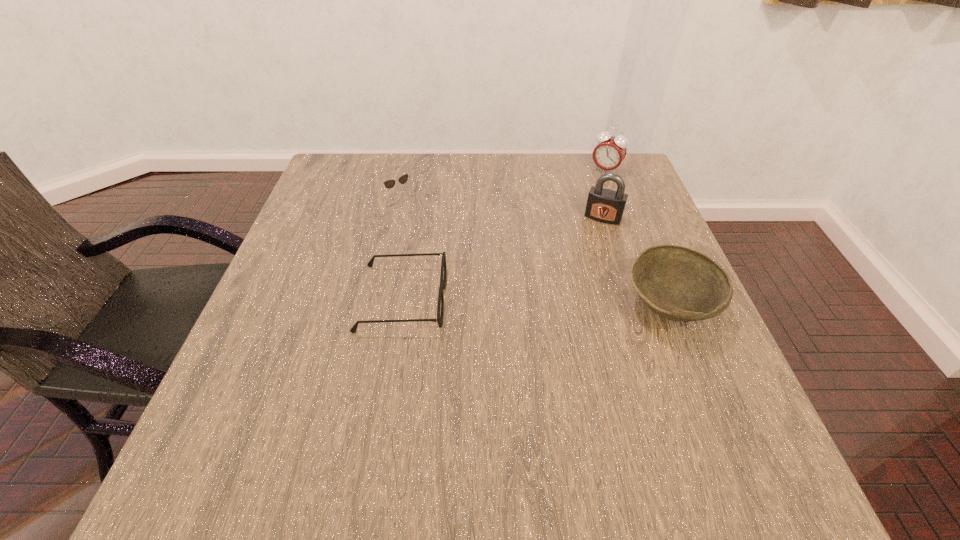
Identify the location of unoccupied area between the shortest object and the farthest object. The image size is (960, 540). (504, 234).

Find the location of a particular element. The width and height of the screenshot is (960, 540). vacant region between the alarm clock and the sunglasses is located at coordinates (503, 184).

Find the location of a particular element. The image size is (960, 540). free space between the bowl and the sunglasses is located at coordinates (535, 252).

Where is `free space between the padlock and the sunglasses`? The width and height of the screenshot is (960, 540). free space between the padlock and the sunglasses is located at coordinates (502, 208).

Find the location of `vacant space in between the padlock and the sunglasses`. vacant space in between the padlock and the sunglasses is located at coordinates (502, 208).

Locate an element on the screen. Image resolution: width=960 pixels, height=540 pixels. unoccupied position between the spectacles and the alarm clock is located at coordinates (504, 234).

I want to click on vacant area between the sunglasses and the bowl, so click(x=535, y=252).

Locate an element on the screen. This screenshot has width=960, height=540. empty location between the bowl and the shortest object is located at coordinates (535, 302).

Identify which object is the nearest to the bowl. Please provide its 2D coordinates. Your answer should be formatted as a tuple, i.e. [(x, y)], where the tuple contains the x and y coordinates of a point satisfying the conditions above.

[(604, 205)]

Identify the location of object that is the second nearest to the sunglasses. The image size is (960, 540). (604, 205).